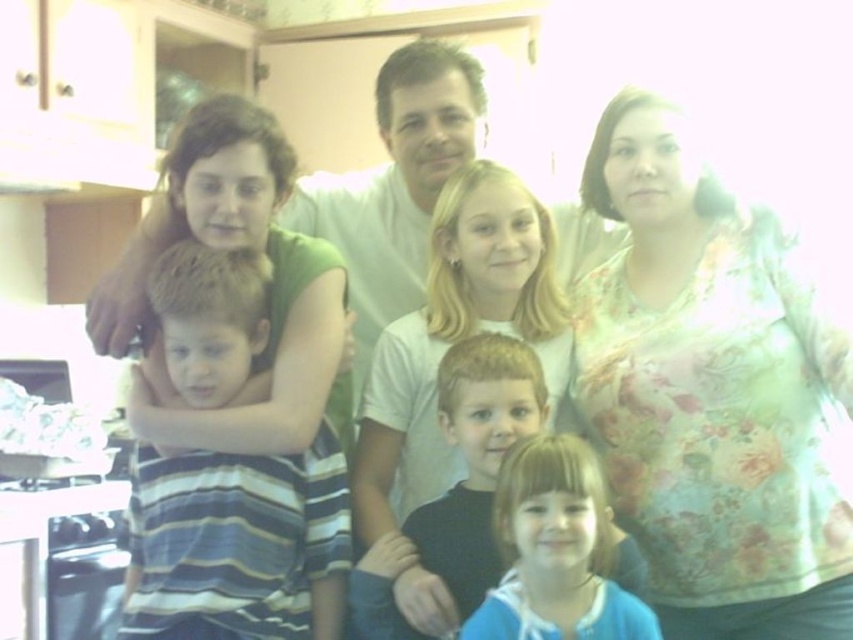
Does floral printed shirt at right come in front of striped fabric shirt at left?

No, floral printed shirt at right is further to the viewer.

Which is below, floral printed shirt at right or striped fabric shirt at left?

striped fabric shirt at left

Who is more distant from viewer, (682, 404) or (268, 496)?

Point (682, 404)

You are a GUI agent. You are given a task and a screenshot of the screen. Output one action in this format:
    pyautogui.click(x=<x>, y=<y>)
    Task: Click on the floral printed shirt at right
    
    Given the screenshot: What is the action you would take?
    pyautogui.click(x=711, y=392)

Which of these two, dark blue hoodie at center or blue fabric shirt at lower center, stands shorter?

blue fabric shirt at lower center

Does dark blue hoodie at center come behind blue fabric shirt at lower center?

Yes, it is behind blue fabric shirt at lower center.

Where is `dark blue hoodie at center`? Image resolution: width=853 pixels, height=640 pixels. dark blue hoodie at center is located at coordinates (456, 492).

Who is positioned more to the left, floral printed shirt at right or blue fabric shirt at lower center?

blue fabric shirt at lower center is more to the left.

Who is shorter, floral printed shirt at right or blue fabric shirt at lower center?

Standing shorter between the two is blue fabric shirt at lower center.

Which is in front, point (706, 182) or point (622, 614)?

Positioned in front is point (622, 614).

Identify the location of floral printed shirt at right. point(711,392).